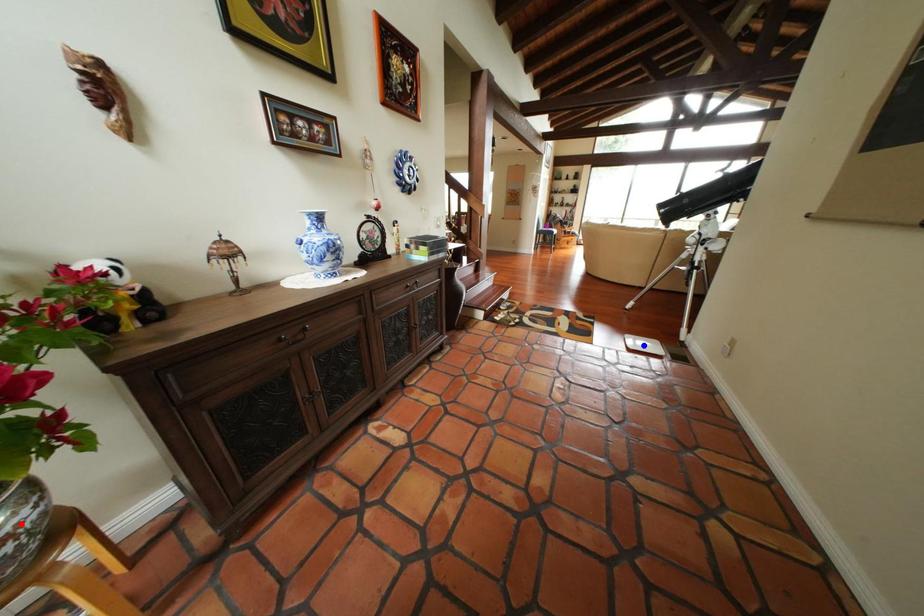
Question: In the image, two points are highlighted. Which point is nearer to the camera? Reply with the corresponding letter.

Choices:
 (A) blue point
 (B) red point

Answer: (B)